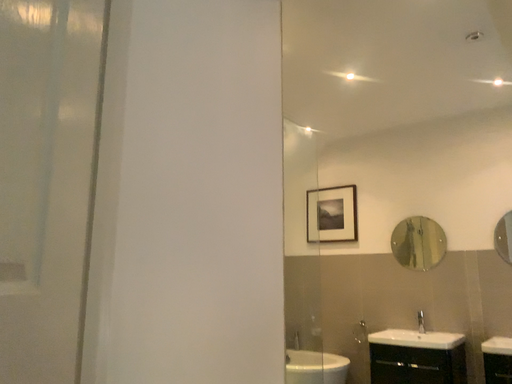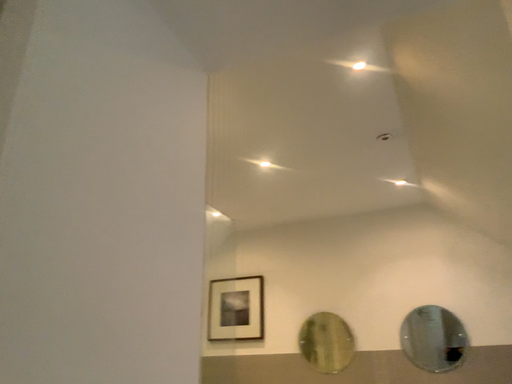
Question: Which way did the camera rotate in the video?

Choices:
 (A) rotated downward
 (B) rotated upward

Answer: (B)